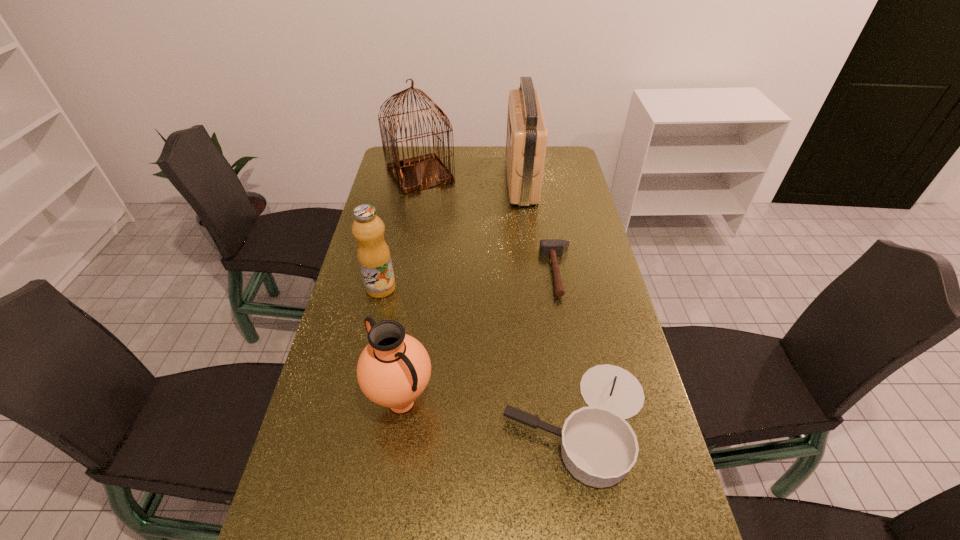
You are a GUI agent. You are given a task and a screenshot of the screen. Output one action in this format:
    pyautogui.click(x=<x>, y=<y>)
    Task: Click on the vacant space that satisfies the following two spatial constraints: 1. on the striking surface of the hammer; 2. on the front side of the pitcher
    This screenshot has width=960, height=540.
    Given the screenshot: What is the action you would take?
    pyautogui.click(x=582, y=402)

Image resolution: width=960 pixels, height=540 pixels. In order to click on free space that satisfies the following two spatial constraints: 1. on the front label of the fruit juice; 2. on the right side of the second shortest object in this screenshot , I will do `click(350, 422)`.

Where is `free point that satisfies the following two spatial constraints: 1. on the front label of the fruit juice; 2. on the right side of the pitcher`? This screenshot has width=960, height=540. free point that satisfies the following two spatial constraints: 1. on the front label of the fruit juice; 2. on the right side of the pitcher is located at coordinates pos(355,402).